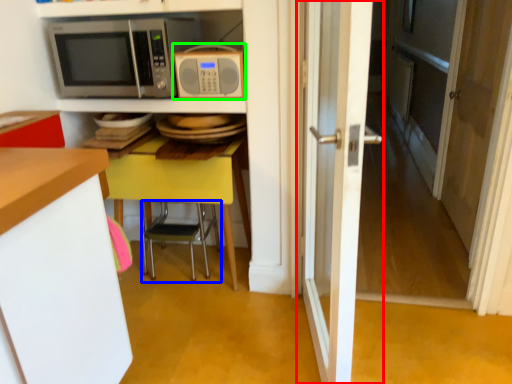
Question: Which is nearer to the door (highlighted by a red box)? chair (highlighted by a blue box) or microwave oven (highlighted by a green box).

Choices:
 (A) chair
 (B) microwave oven

Answer: (B)